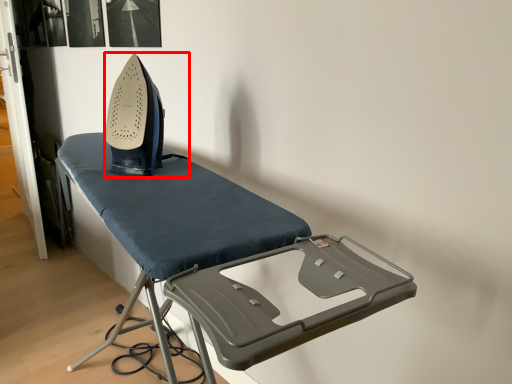
Question: From the image's perspective, what is the correct spatial positioning of equipment (annotated by the red box) in reference to furniture?

Choices:
 (A) below
 (B) above

Answer: (B)